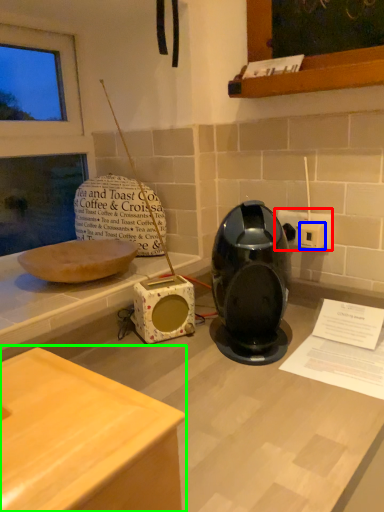
Question: Considering the real-world distances, which object is closest to electric outlet (highlighted by a red box)? electric outlet (highlighted by a blue box) or table (highlighted by a green box).

Choices:
 (A) electric outlet
 (B) table

Answer: (A)